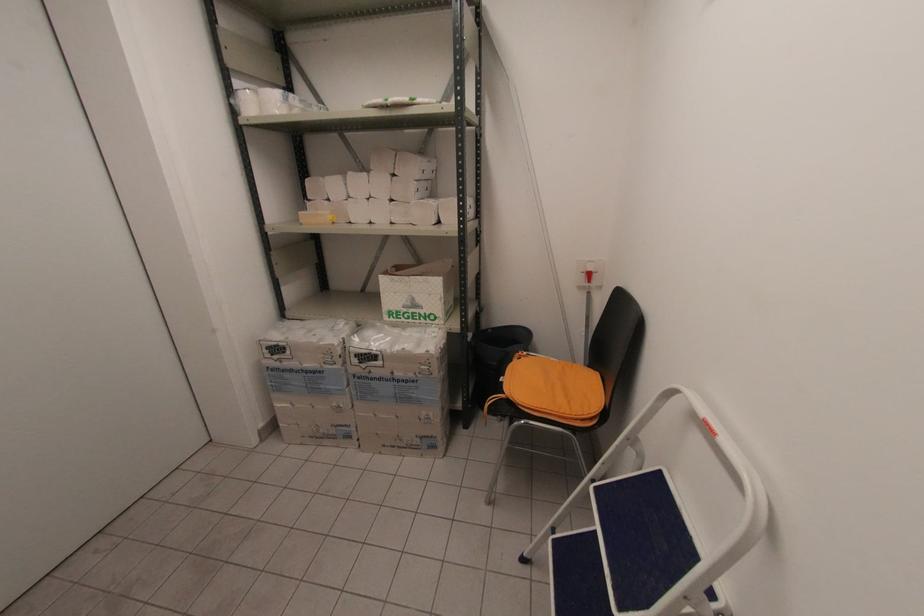
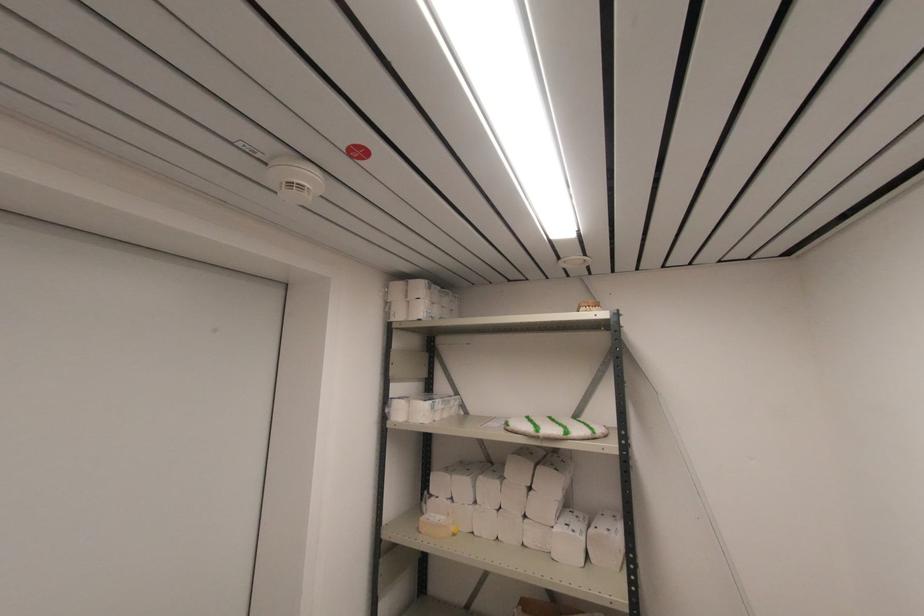
Locate, in the second image, the point that corresponds to the point at 385,103 in the first image.

(537, 436)